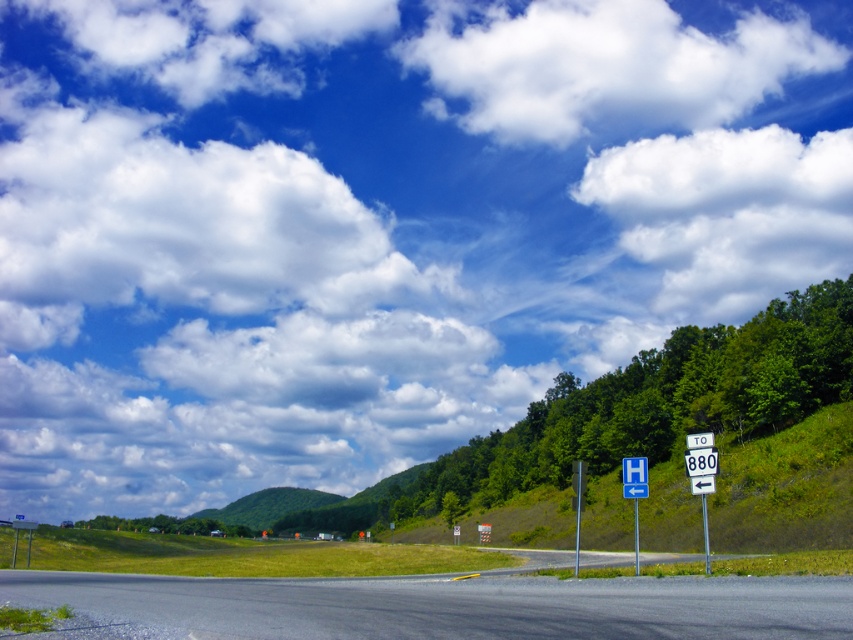
Who is lower down, asphalt road at lower center or metallic signpost at right?

metallic signpost at right is below.

Does asphalt road at lower center have a larger size compared to metallic signpost at right?

No.

Who is more distant from viewer, (621, 625) or (709, 572)?

The point (709, 572) is more distant.

Image resolution: width=853 pixels, height=640 pixels. Identify the location of asphalt road at lower center. (439, 605).

Looking at this image, who is positioned more to the right, blue plastic sign at upper center or blue metallic signpost at upper center?

blue metallic signpost at upper center

Which of these two, blue plastic sign at upper center or blue metallic signpost at upper center, stands taller?

With more height is blue metallic signpost at upper center.

Where is `blue plastic sign at upper center`? blue plastic sign at upper center is located at coordinates (634, 477).

Find the location of `blue plastic sign at upper center`. blue plastic sign at upper center is located at coordinates pos(634,477).

Does asphalt road at lower center have a lesser height compared to blue metallic signpost at upper center?

Yes.

Between asphalt road at lower center and blue metallic signpost at upper center, which one appears on the left side from the viewer's perspective?

Positioned to the left is asphalt road at lower center.

Which is in front, point (712, 625) or point (637, 566)?

Point (712, 625) is in front.

The image size is (853, 640). Identify the location of asphalt road at lower center. (439, 605).